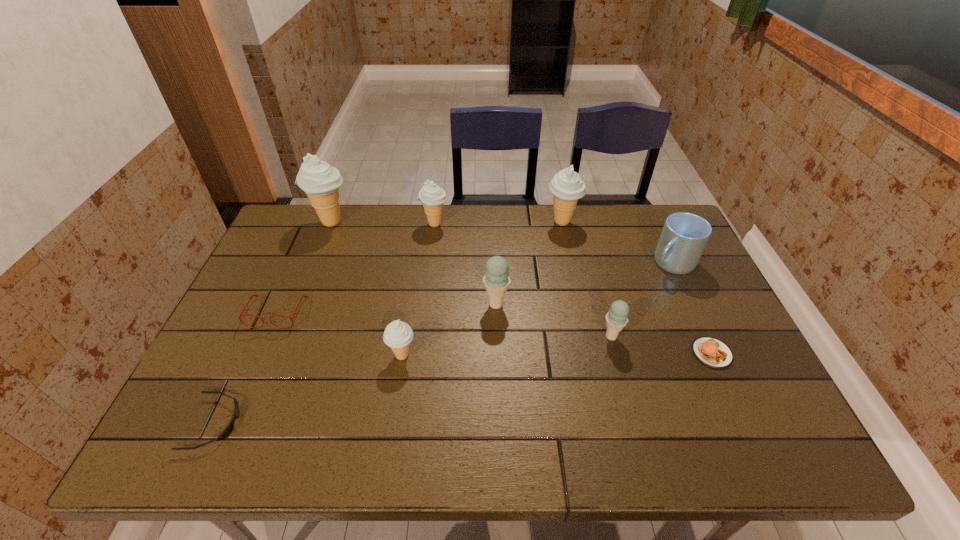
At what (x,y) coordinates should I click in order to perform the action: click on vacant space that satisfies the following two spatial constraints: 1. on the front side of the tallest object; 2. on the right side of the third biggest beige icecream. Please return your answer as a coordinate pair (x, y). The height and width of the screenshot is (540, 960). Looking at the image, I should click on (330, 224).

Locate an element on the screen. The height and width of the screenshot is (540, 960). vacant position in the image that satisfies the following two spatial constraints: 1. on the face of the third shortest object; 2. on the left side of the nearest beige icecream is located at coordinates (257, 355).